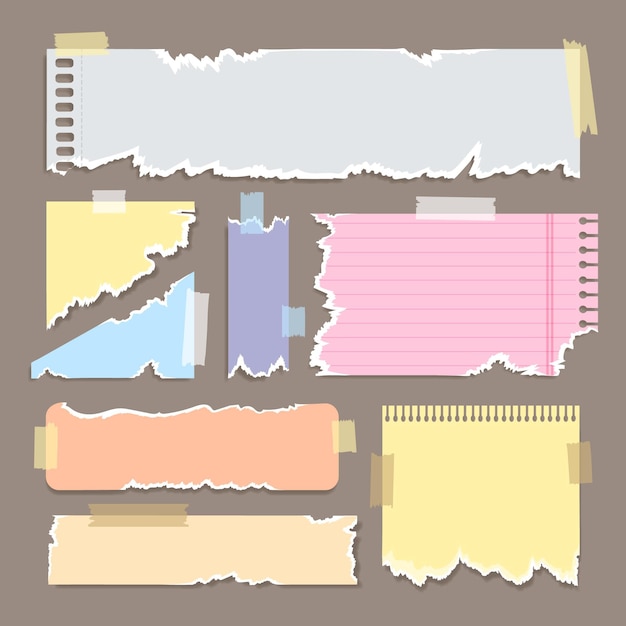
I want to click on torn pieces of cellophane tape, so click(x=111, y=196), click(x=202, y=312), click(x=244, y=203), click(x=295, y=319), click(x=441, y=210).